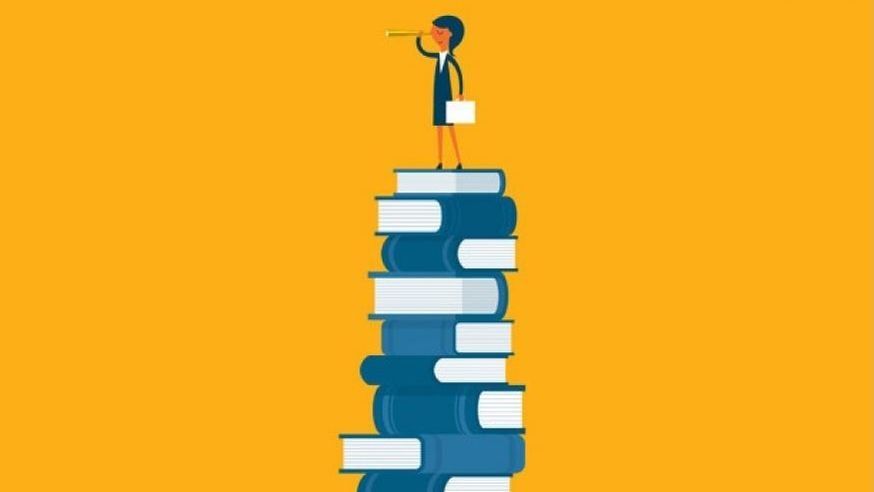
Identify the location of book. (422, 187), (410, 211), (427, 256), (420, 299), (427, 334), (420, 369), (427, 411), (421, 453), (434, 482).